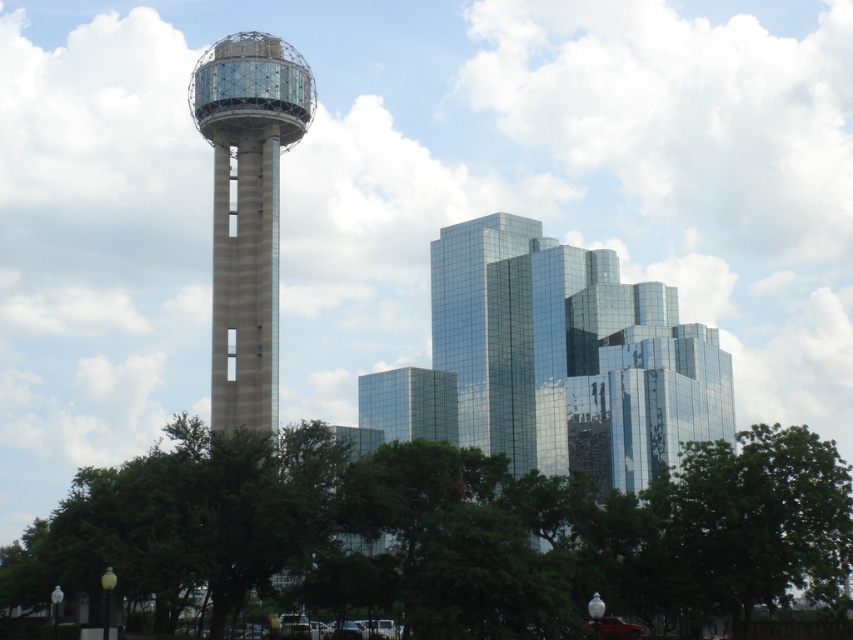
Which of these two, glassy reflective skyscraper at center or concrete glass tower at center, stands shorter?

glassy reflective skyscraper at center is shorter.

Which is in front, point (498, 246) or point (254, 308)?

Point (254, 308) is in front.

Locate an element on the screen. glassy reflective skyscraper at center is located at coordinates (569, 355).

Does green leafy tree at lower center have a greater height compared to concrete glass tower at center?

No.

Between green leafy tree at lower center and concrete glass tower at center, which one has more height?

concrete glass tower at center is taller.

Find the location of a particular element. Image resolution: width=853 pixels, height=640 pixels. green leafy tree at lower center is located at coordinates click(445, 531).

Does green leafy tree at lower center have a smaller size compared to glassy reflective skyscraper at center?

No, green leafy tree at lower center is not smaller than glassy reflective skyscraper at center.

At what (x,y) coordinates should I click in order to perform the action: click on green leafy tree at lower center. Please return your answer as a coordinate pair (x, y). The image size is (853, 640). Looking at the image, I should click on (445, 531).

Where is `green leafy tree at lower center`? The image size is (853, 640). green leafy tree at lower center is located at coordinates (445, 531).